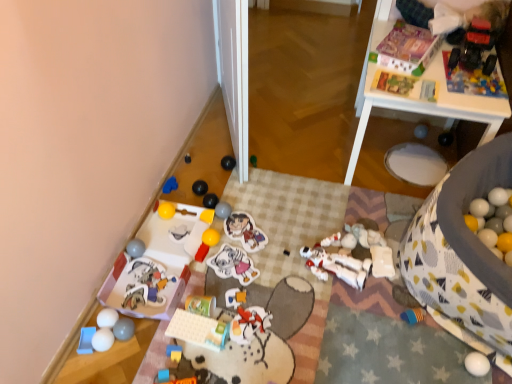
Where is `unoccupied space behind white matte sticker at center, which is the nineteenth toy from left to right`? This screenshot has width=512, height=384. unoccupied space behind white matte sticker at center, which is the nineteenth toy from left to right is located at coordinates (242, 234).